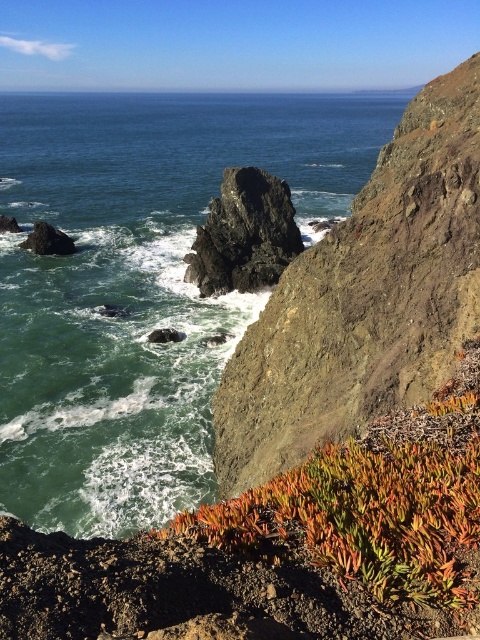
Question: Which point is farther to the camera?

Choices:
 (A) (392, 204)
 (B) (62, 232)
 (C) (228, 246)

Answer: (B)

Question: Does rough gray cliff at center come in front of rough rock at center?

Choices:
 (A) no
 (B) yes

Answer: (B)

Question: Which point is farther from the camera taking this photo?

Choices:
 (A) (251, 477)
 (B) (106, 273)

Answer: (B)

Question: Does rough rock at center have a larger size compared to dark gray rock at left?

Choices:
 (A) yes
 (B) no

Answer: (A)

Question: Does green water at center appear over rough rock at center?

Choices:
 (A) yes
 (B) no

Answer: (A)

Question: Which of the following is the farthest from the observer?

Choices:
 (A) (231, 189)
 (B) (190, 339)
 (C) (394, 538)

Answer: (A)